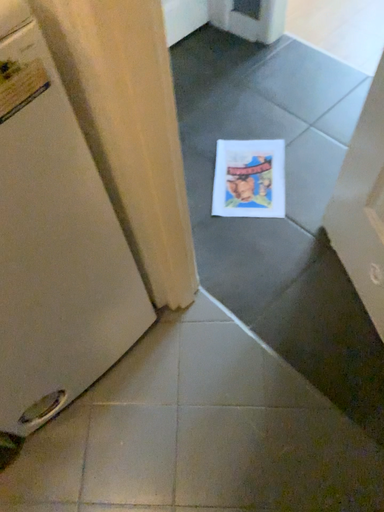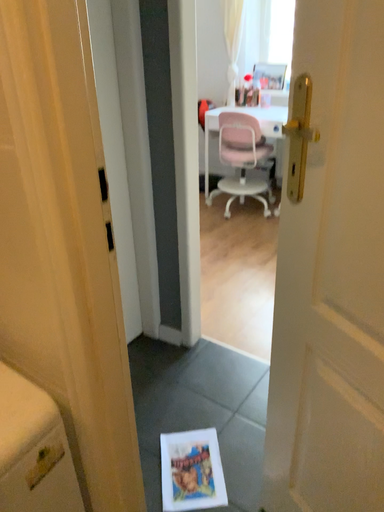
Question: Which way did the camera rotate in the video?

Choices:
 (A) rotated right
 (B) rotated left

Answer: (A)